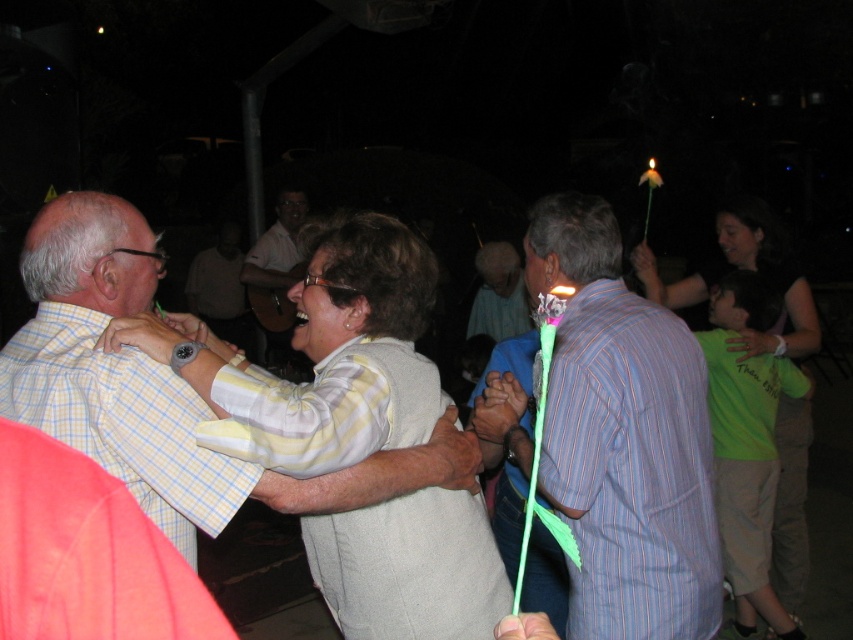
What are the coordinates of `yellow checkered shirt at left` in the screenshot? It's located at tap(112, 369).

Can you confirm if yellow checkered shirt at left is shorter than matte white shirt at center?

Yes.

Locate an element on the screen. yellow checkered shirt at left is located at coordinates (112, 369).

Image resolution: width=853 pixels, height=640 pixels. I want to click on yellow checkered shirt at left, so click(x=112, y=369).

Based on the photo, is green plastic candle at right bigger than matte white shirt at center?

No, green plastic candle at right is not bigger than matte white shirt at center.

Which of these two, green plastic candle at right or matte white shirt at center, stands shorter?

green plastic candle at right is shorter.

The image size is (853, 640). Find the location of `green plastic candle at right`. green plastic candle at right is located at coordinates (624, 438).

Which is more to the right, light gray sweater at center or matte white shirt at center?

Positioned to the right is light gray sweater at center.

Who is taller, light gray sweater at center or matte white shirt at center?

With more height is matte white shirt at center.

At what (x,y) coordinates should I click in order to perform the action: click on light gray sweater at center. Please return your answer as a coordinate pair (x, y). This screenshot has height=640, width=853. Looking at the image, I should click on (318, 356).